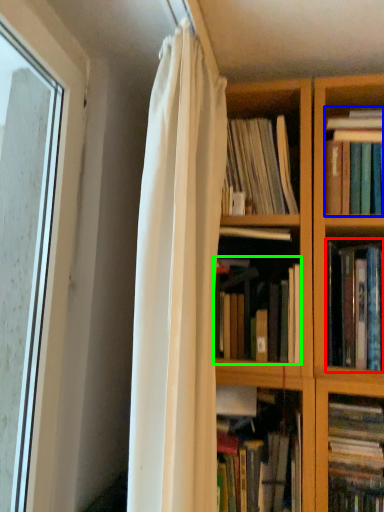
Question: Based on their relative distances, which object is nearer to book (highlighted by a red box)? Choose from book (highlighted by a blue box) and book (highlighted by a green box).

Choices:
 (A) book
 (B) book

Answer: (B)